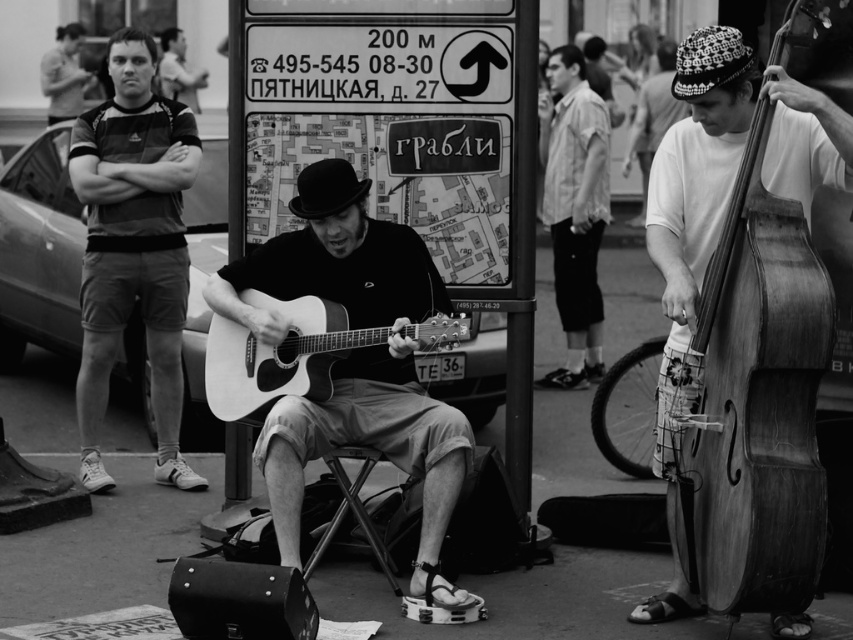
From the picture: Who is more forward, (454, 336) or (650, 129)?

Point (454, 336)

Is acoustic wood guitar at center to the left of knitted wool hat at upper right from the viewer's perspective?

Indeed, acoustic wood guitar at center is positioned on the left side of knitted wool hat at upper right.

Does point (241, 365) come behind point (634, 113)?

No.

I want to click on acoustic wood guitar at center, so click(297, 353).

Is wooden cello at right to the right of striped cotton shirt at upper right from the viewer's perspective?

Indeed, wooden cello at right is positioned on the right side of striped cotton shirt at upper right.

Which is more to the right, wooden cello at right or striped cotton shirt at upper right?

Positioned to the right is wooden cello at right.

This screenshot has width=853, height=640. I want to click on wooden cello at right, so click(741, 326).

Who is shorter, matte acoustic guitar at center or knitted wool hat at upper right?

knitted wool hat at upper right

Does point (254, 330) come closer to viewer compared to point (646, 148)?

Yes, it is.

Describe the element at coordinates (355, 364) in the screenshot. I see `matte acoustic guitar at center` at that location.

This screenshot has height=640, width=853. What are the coordinates of `matte acoustic guitar at center` in the screenshot? It's located at (355, 364).